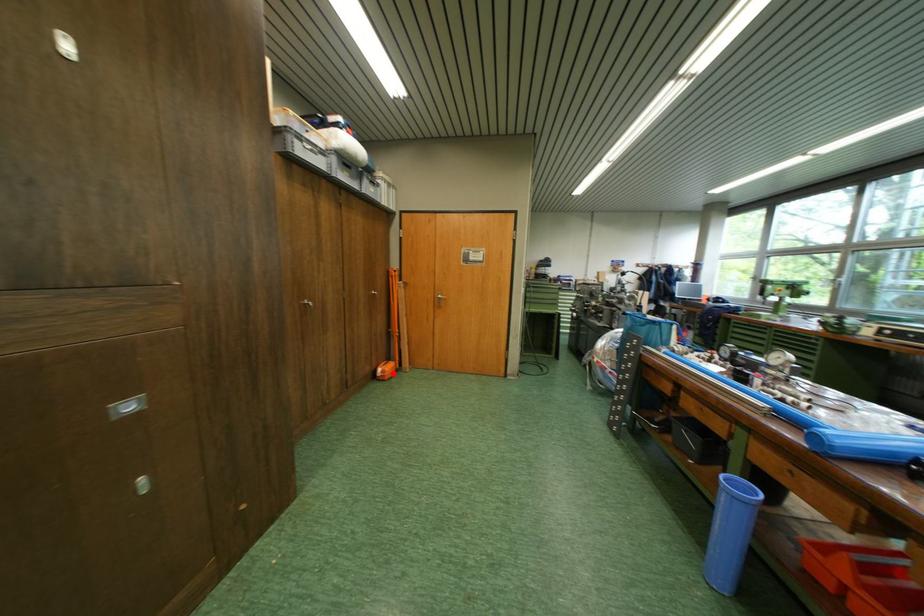
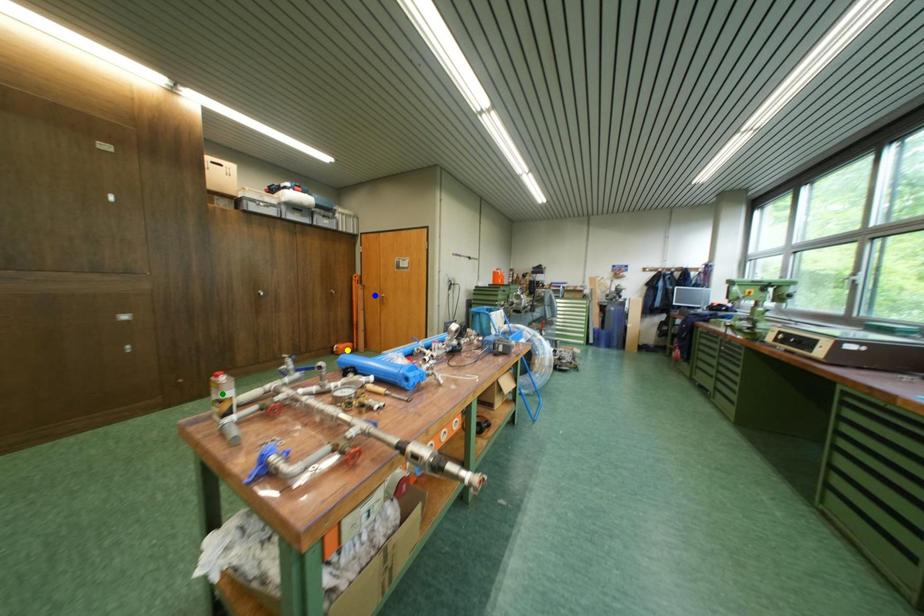
Question: I am providing you with two images of the same scene from different viewpoints. A red point is marked on the first image. You are given multiple points on the second image. Can you choose the point in image 2 that corresponds to the point in image 1?

Choices:
 (A) green point
 (B) yellow point
 (C) blue point

Answer: (B)